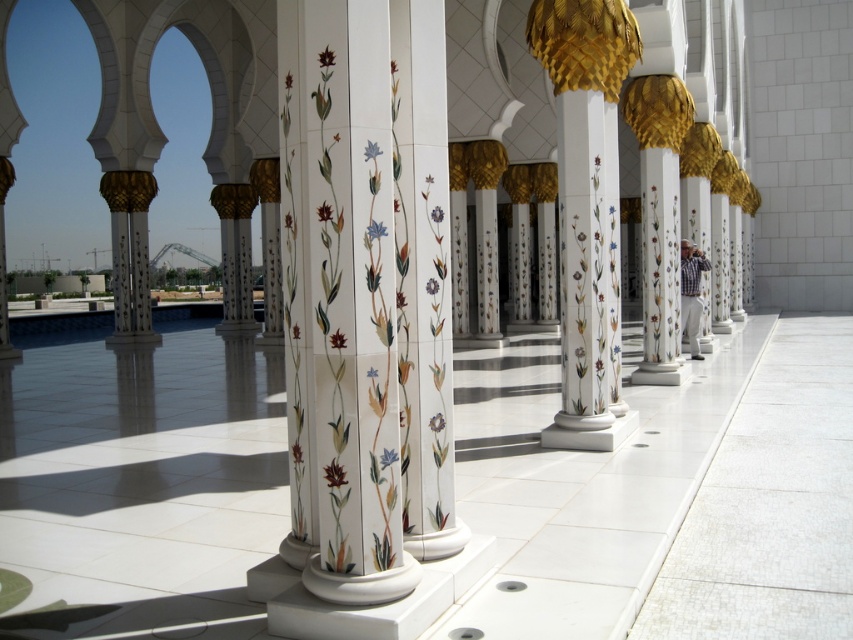
Can you confirm if porcelain floral columns at center is wider than white marble column at center?

No.

Describe the element at coordinates (349, 292) in the screenshot. I see `porcelain floral columns at center` at that location.

I want to click on porcelain floral columns at center, so click(349, 292).